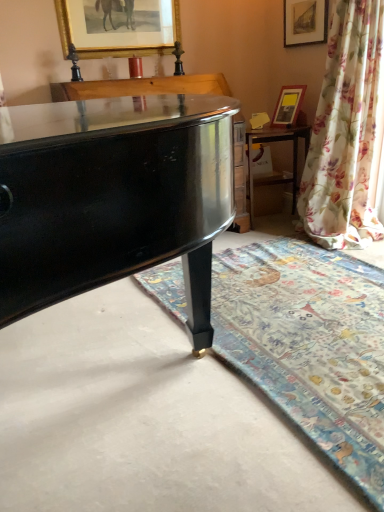
Question: Is matte gold picture frame at upper right, which ranks as the first picture frame in right-to-left order, thinner than carpet with floral pattern at lower right?

Choices:
 (A) no
 (B) yes

Answer: (B)

Question: Considering the relative positions of matte gold picture frame at upper right, which ranks as the first picture frame in right-to-left order, and carpet with floral pattern at lower right in the image provided, is matte gold picture frame at upper right, which ranks as the first picture frame in right-to-left order, to the left of carpet with floral pattern at lower right from the viewer's perspective?

Choices:
 (A) no
 (B) yes

Answer: (A)

Question: Is matte gold picture frame at upper right, which ranks as the first picture frame in right-to-left order, in contact with carpet with floral pattern at lower right?

Choices:
 (A) yes
 (B) no

Answer: (B)

Question: Can carpet with floral pattern at lower right be found inside matte gold picture frame at upper right, which ranks as the first picture frame in right-to-left order?

Choices:
 (A) no
 (B) yes

Answer: (A)

Question: Is matte gold picture frame at upper right, which ranks as the first picture frame in right-to-left order, closer to the viewer compared to carpet with floral pattern at lower right?

Choices:
 (A) no
 (B) yes

Answer: (A)

Question: From a real-world perspective, is carpet with floral pattern at lower right above or below matte gold picture frame at upper right, the 2th picture frame when ordered from left to right?

Choices:
 (A) below
 (B) above

Answer: (A)

Question: Considering the relative positions of carpet with floral pattern at lower right and matte gold picture frame at upper right, the 2th picture frame when ordered from left to right, in the image provided, is carpet with floral pattern at lower right to the left or to the right of matte gold picture frame at upper right, the 2th picture frame when ordered from left to right,?

Choices:
 (A) left
 (B) right

Answer: (A)

Question: From the image's perspective, is carpet with floral pattern at lower right positioned above or below matte gold picture frame at upper right, the 2th picture frame when ordered from left to right?

Choices:
 (A) below
 (B) above

Answer: (A)

Question: Looking at the image, does carpet with floral pattern at lower right seem bigger or smaller compared to matte gold picture frame at upper right, the 2th picture frame when ordered from left to right?

Choices:
 (A) big
 (B) small

Answer: (A)

Question: Is matte gold picture frame at upper right, which is the third picture frame from left to right, to the left or to the right of wooden table at right in the image?

Choices:
 (A) right
 (B) left

Answer: (A)

Question: In terms of size, does matte gold picture frame at upper right, which is the third picture frame from left to right, appear bigger or smaller than wooden table at right?

Choices:
 (A) big
 (B) small

Answer: (B)

Question: Is matte gold picture frame at upper right, which ranks as the first picture frame in right-to-left order, wider or thinner than wooden table at right?

Choices:
 (A) thin
 (B) wide

Answer: (A)

Question: From the image's perspective, is matte gold picture frame at upper right, which is the third picture frame from left to right, above or below wooden table at right?

Choices:
 (A) above
 (B) below

Answer: (A)

Question: Considering their positions, is carpet with floral pattern at lower right located in front of or behind wooden table at right?

Choices:
 (A) front
 (B) behind

Answer: (A)

Question: From the image's perspective, is carpet with floral pattern at lower right positioned above or below wooden table at right?

Choices:
 (A) below
 (B) above

Answer: (A)